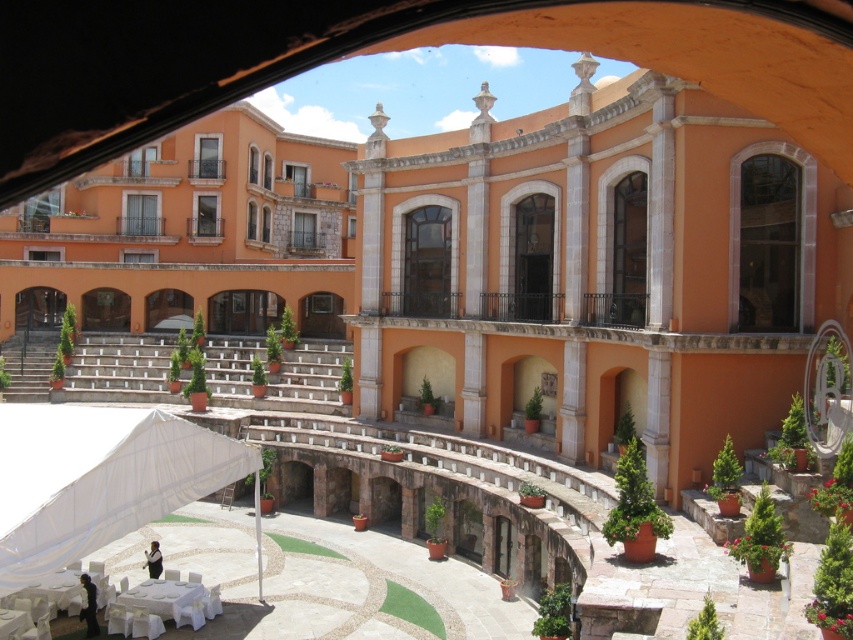
Looking at this image, is white fabric canopy at lower left further to camera compared to white cloth-covered table at lower center?

No, it is in front of white cloth-covered table at lower center.

Is point (167, 493) closer to viewer compared to point (144, 624)?

Yes, it is.

The width and height of the screenshot is (853, 640). I want to click on white fabric canopy at lower left, so click(97, 477).